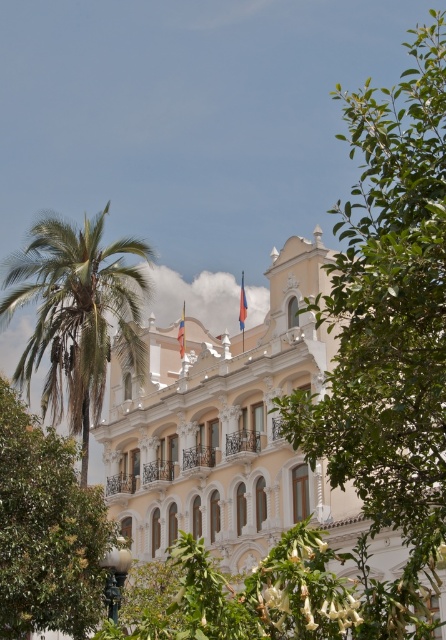
You are standing in front of the grand building and want to walk from the point at coordinates point (42, 236) to the point at coordinates point (178, 339). Which direction should you move relative to the building?

You should move towards the building because point (42, 236) is in front of point (178, 339), meaning the destination is behind the starting point relative to the building.

You are a photographer planning to capture the white ornate building at center and the green leafy tree at center in a single shot. Based on their sizes, which object would likely occupy more space in the photo?

The white ornate building at center might be wider than green leafy tree at center, so it would likely occupy more space in the photo.

You are a window cleaner working on the building. You need to clean both the green leafy tree at upper right and the orange fabric flag at upper center. Which object should you tackle first based on their vertical positions?

The green leafy tree at upper right is above the orange fabric flag at upper center, so you should clean the green leafy tree at upper right first as it is higher up.